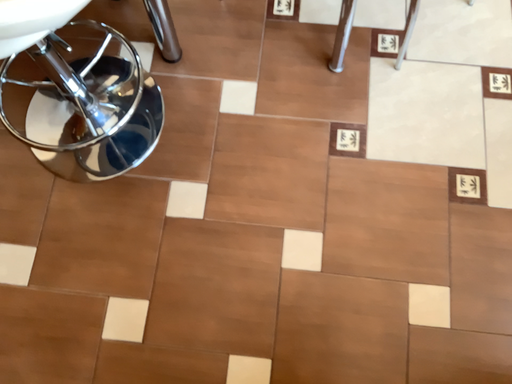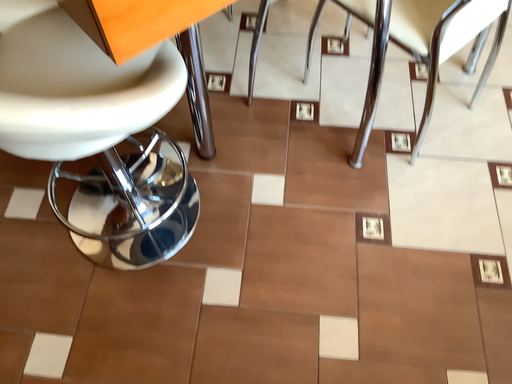
Question: Which way did the camera rotate in the video?

Choices:
 (A) rotated downward
 (B) rotated upward

Answer: (B)